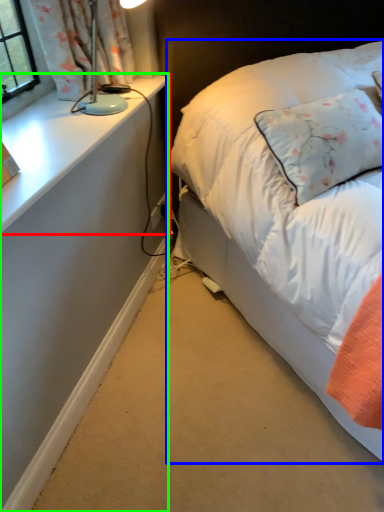
Question: Estimate the real-world distances between objects in this image. Which object is farther from table (highlighted by a red box), bed (highlighted by a blue box) or desk (highlighted by a green box)?

Choices:
 (A) bed
 (B) desk

Answer: (A)